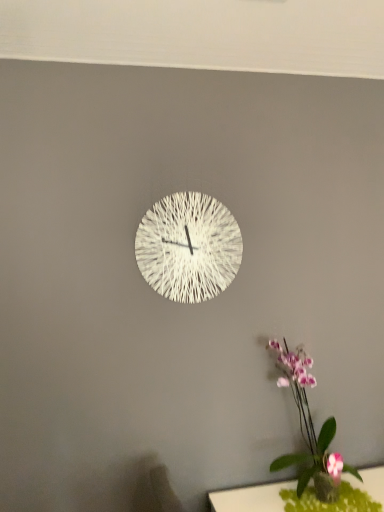
Describe the element at coordinates (251, 498) in the screenshot. Image resolution: width=384 pixels, height=512 pixels. I see `green felt table at lower right` at that location.

I want to click on white woven clock at center, so click(188, 247).

Locate an element on the screen. The width and height of the screenshot is (384, 512). purple-pink orchid at lower right is located at coordinates (309, 429).

Find the location of a particular element. Image resolution: width=384 pixels, height=512 pixels. floral arrangement in front of the white woven clock at center is located at coordinates (309, 429).

In the scene shown: Can you confirm if purple-pink orchid at lower right is wider than white woven clock at center?

Yes.

Is purple-pink orchid at lower right positioned in front of white woven clock at center?

Yes, purple-pink orchid at lower right is in front of white woven clock at center.

From a real-world perspective, does purple-pink orchid at lower right stand above white woven clock at center?

No.

Would you consider green felt table at lower right to be distant from purple-pink orchid at lower right?

green felt table at lower right is actually quite close to purple-pink orchid at lower right.

Is green felt table at lower right located outside purple-pink orchid at lower right?

That's correct, green felt table at lower right is outside of purple-pink orchid at lower right.

Between green felt table at lower right and purple-pink orchid at lower right, which one has smaller size?

green felt table at lower right.

From a real-world perspective, is green felt table at lower right on purple-pink orchid at lower right?

Incorrect, from a real-world perspective, green felt table at lower right is lower than purple-pink orchid at lower right.

From their relative heights in the image, would you say white woven clock at center is taller or shorter than green felt table at lower right?

In the image, white woven clock at center appears to be taller than green felt table at lower right.

From the image's perspective, is white woven clock at center above or below green felt table at lower right?

Clearly, from the image's perspective, white woven clock at center is above green felt table at lower right.

Considering the sizes of objects white woven clock at center and green felt table at lower right in the image provided, who is bigger, white woven clock at center or green felt table at lower right?

With larger size is white woven clock at center.

Can you confirm if white woven clock at center is taller than purple-pink orchid at lower right?

In fact, white woven clock at center may be shorter than purple-pink orchid at lower right.

Considering the sizes of objects white woven clock at center and purple-pink orchid at lower right in the image provided, who is bigger, white woven clock at center or purple-pink orchid at lower right?

Bigger between the two is purple-pink orchid at lower right.

From a real-world perspective, which object rests below the other?

purple-pink orchid at lower right, from a real-world perspective.

Where is `table in front of the purple-pink orchid at lower right`? Image resolution: width=384 pixels, height=512 pixels. table in front of the purple-pink orchid at lower right is located at coordinates (251, 498).

From the image's perspective, is purple-pink orchid at lower right located above or below green felt table at lower right?

purple-pink orchid at lower right is above green felt table at lower right.

Is purple-pink orchid at lower right taller or shorter than green felt table at lower right?

Considering their sizes, purple-pink orchid at lower right has more height than green felt table at lower right.

Would you say green felt table at lower right is inside or outside white woven clock at center?

green felt table at lower right is located beyond the bounds of white woven clock at center.

The height and width of the screenshot is (512, 384). Find the location of `wall clock on the left of green felt table at lower right`. wall clock on the left of green felt table at lower right is located at coordinates (188, 247).

From the picture: Does green felt table at lower right have a larger size compared to white woven clock at center?

Incorrect, green felt table at lower right is not larger than white woven clock at center.

Is green felt table at lower right further to the viewer compared to white woven clock at center?

No, green felt table at lower right is closer to the viewer.

This screenshot has height=512, width=384. What are the coordinates of `wall clock to the left of purple-pink orchid at lower right` in the screenshot? It's located at (188, 247).

This screenshot has height=512, width=384. I want to click on table below the purple-pink orchid at lower right (from the image's perspective), so click(251, 498).

Looking at the image, which one is located further to green felt table at lower right, purple-pink orchid at lower right or white woven clock at center?

white woven clock at center is further to green felt table at lower right.

Based on their spatial positions, is purple-pink orchid at lower right or green felt table at lower right further from white woven clock at center?

green felt table at lower right.

From the image, which object appears to be nearer to purple-pink orchid at lower right, green felt table at lower right or white woven clock at center?

green felt table at lower right is closer to purple-pink orchid at lower right.

Considering their positions, is white woven clock at center positioned further to purple-pink orchid at lower right than green felt table at lower right?

Among the two, white woven clock at center is located further to purple-pink orchid at lower right.

From the picture: When comparing their distances from white woven clock at center, does green felt table at lower right or purple-pink orchid at lower right seem closer?

The object closer to white woven clock at center is purple-pink orchid at lower right.

Considering their positions, is white woven clock at center positioned closer to green felt table at lower right than purple-pink orchid at lower right?

purple-pink orchid at lower right is positioned closer to the anchor green felt table at lower right.

Where is `floral arrangement between white woven clock at center and green felt table at lower right in the up-down direction`? This screenshot has width=384, height=512. floral arrangement between white woven clock at center and green felt table at lower right in the up-down direction is located at coordinates (309, 429).